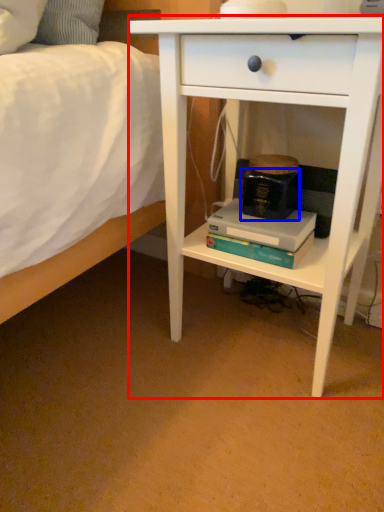
Question: Which point is closer to the camera, nightstand (highlighted by a red box) or paperback book (highlighted by a blue box)?

Choices:
 (A) nightstand
 (B) paperback book

Answer: (A)